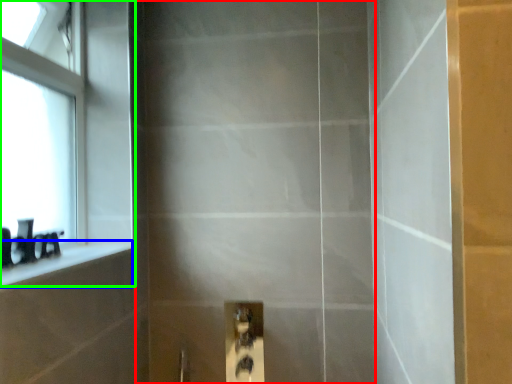
Question: Which is nearer to the screen door (highlighted by a red box)? ledge (highlighted by a blue box) or window (highlighted by a green box).

Choices:
 (A) ledge
 (B) window

Answer: (B)